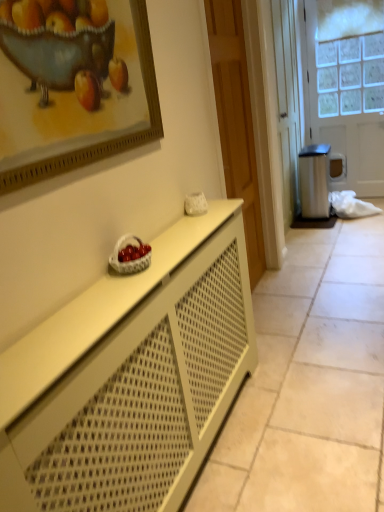
Question: Looking at the image, does wooden door at center, which is the 1th door from front to back, seem bigger or smaller compared to white wicker basket at center?

Choices:
 (A) big
 (B) small

Answer: (A)

Question: In terms of width, does wooden door at center, the second door in the right-to-left sequence, look wider or thinner when compared to white wicker basket at center?

Choices:
 (A) wide
 (B) thin

Answer: (A)

Question: Which is nearer to the wooden door at center, marked as the second door in a back-to-front arrangement?

Choices:
 (A) wooden framed painting at upper left
 (B) white wicker basket at center
 (C) white matte cabinet at center
 (D) white frosted glass door at right, positioned as the 2th door in left-to-right order

Answer: (A)

Question: Which is farther from the wooden door at center, which is the 1th door from front to back?

Choices:
 (A) white wicker basket at center
 (B) white frosted glass door at right, which is counted as the first door, starting from the back
 (C) wooden framed painting at upper left
 (D) white matte cabinet at center

Answer: (B)